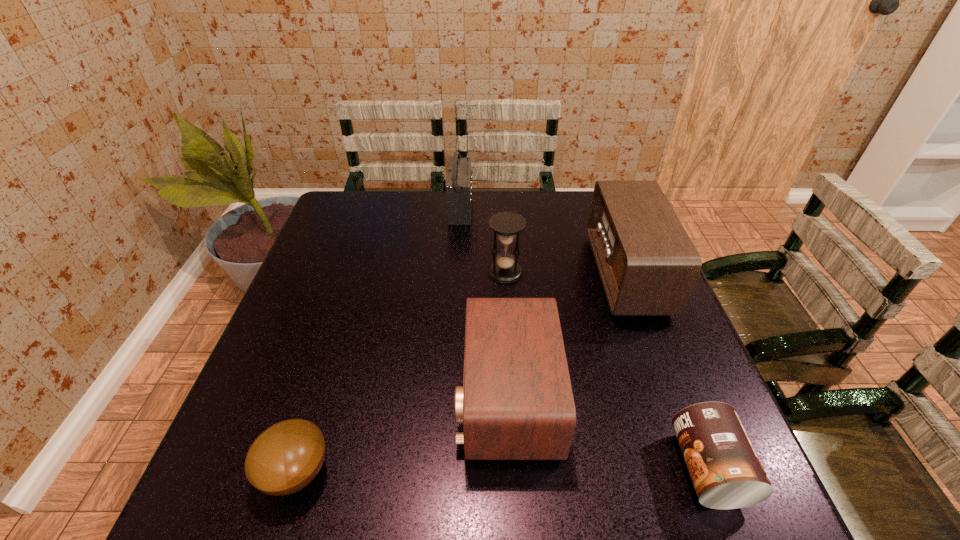
I want to click on vacant point located between the fifth tallest object and the shortest object, so click(x=502, y=470).

Where is `vacant space that is in between the shortest object and the second shortest object`? Image resolution: width=960 pixels, height=540 pixels. vacant space that is in between the shortest object and the second shortest object is located at coordinates (502, 470).

Choose which object is the nearest neighbor to the second tallest object. Please provide its 2D coordinates. Your answer should be formatted as a tuple, i.e. [(x, y)], where the tuple contains the x and y coordinates of a point satisfying the conditions above.

[(516, 403)]

The width and height of the screenshot is (960, 540). Identify the location of the fourth closest object relative to the shortest object. (648, 265).

At what (x,y) coordinates should I click in order to perform the action: click on radio receiver that stands as the second closest to the hourglass. Please return your answer as a coordinate pair (x, y). The image size is (960, 540). Looking at the image, I should click on (516, 403).

Identify which radio receiver is the closest to the tallest object. Please provide its 2D coordinates. Your answer should be formatted as a tuple, i.e. [(x, y)], where the tuple contains the x and y coordinates of a point satisfying the conditions above.

[(648, 265)]

Find the location of a particular element. The height and width of the screenshot is (540, 960). vacant space that satisfies the following two spatial constraints: 1. on the front panel of the nearest radio receiver; 2. on the front side of the leftmost object is located at coordinates (511, 472).

Image resolution: width=960 pixels, height=540 pixels. Find the location of `free location that satisfies the following two spatial constraints: 1. on the back side of the hourglass; 2. on the front panel of the tallest radio receiver`. free location that satisfies the following two spatial constraints: 1. on the back side of the hourglass; 2. on the front panel of the tallest radio receiver is located at coordinates (501, 208).